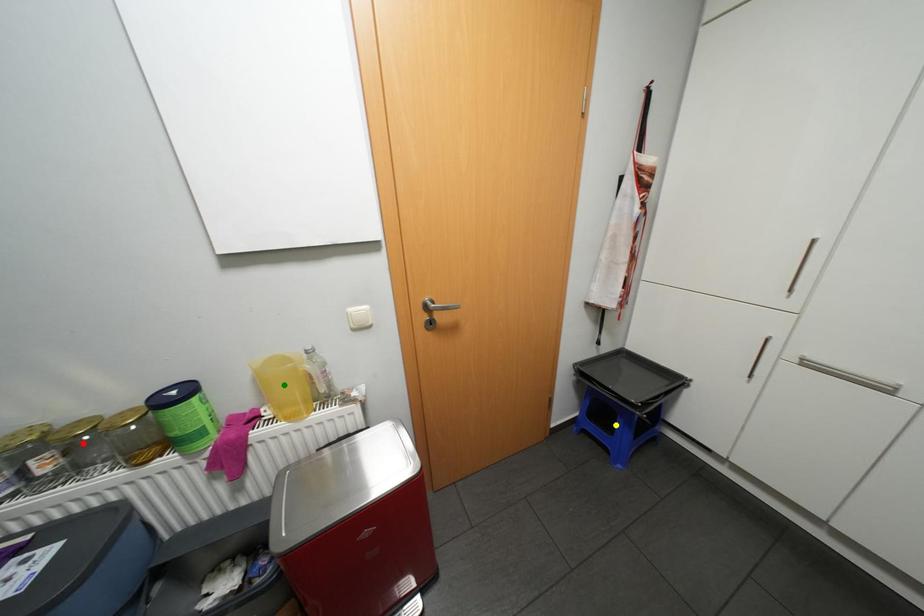
Order these from nearest to farthest:
red point | yellow point | green point

red point < green point < yellow point